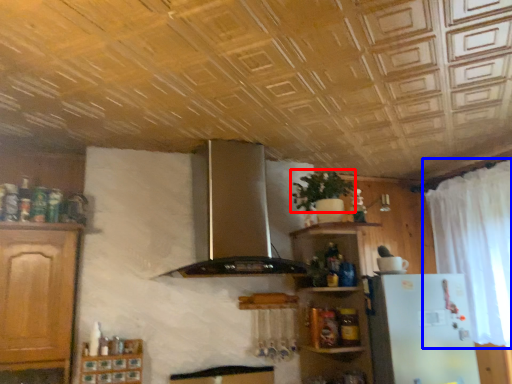
Question: Which point is closer to the camera, plant (highlighted by a red box) or curtain (highlighted by a blue box)?

Choices:
 (A) plant
 (B) curtain

Answer: (B)